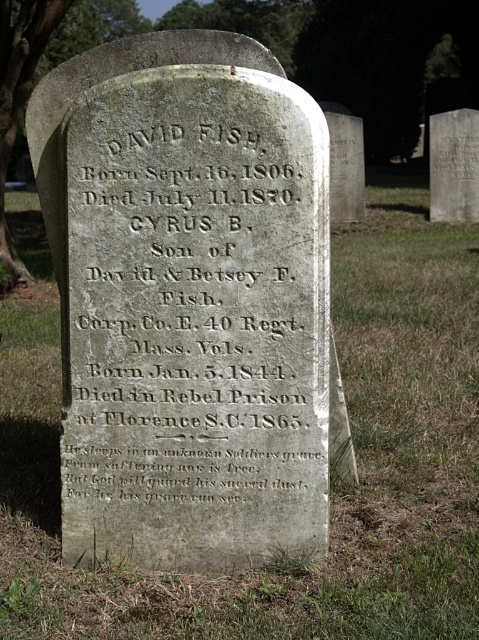
Can you confirm if gray stone inscription at center is positioned above smooth gray stone at upper right?

Incorrect, gray stone inscription at center is not positioned above smooth gray stone at upper right.

Looking at this image, measure the distance from gray stone inscription at center to smooth gray stone at upper right.

gray stone inscription at center and smooth gray stone at upper right are 10.85 meters apart.

Identify the location of gray stone inscription at center. The height and width of the screenshot is (640, 479). (193, 312).